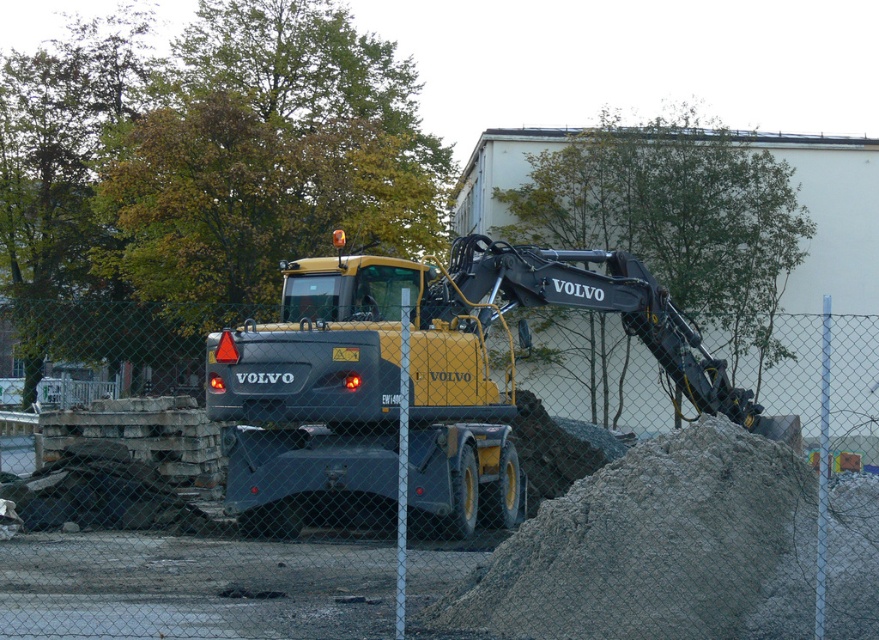
Question: Is metal chain-link fence at center to the left of matte yellow volvo excavator at center from the viewer's perspective?

Choices:
 (A) no
 (B) yes

Answer: (B)

Question: Can you confirm if metal chain-link fence at center is positioned to the right of matte yellow volvo excavator at center?

Choices:
 (A) yes
 (B) no

Answer: (B)

Question: Which point is closer to the camera?

Choices:
 (A) matte yellow volvo excavator at center
 (B) metal chain-link fence at center

Answer: (B)

Question: Is metal chain-link fence at center below matte yellow volvo excavator at center?

Choices:
 (A) no
 (B) yes

Answer: (B)